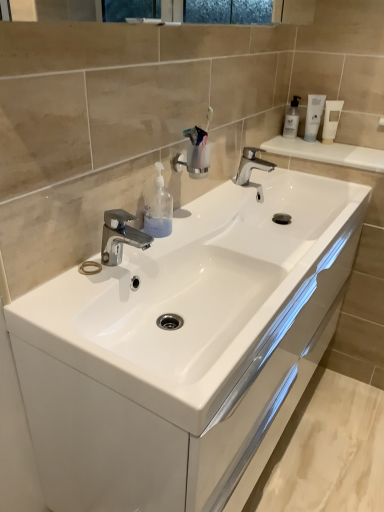
Question: Can you confirm if chrome metallic faucet at upper center, acting as the 2th tap starting from the front, is positioned to the left of white glossy tube at upper right, the first mouthwash from the right?

Choices:
 (A) yes
 (B) no

Answer: (A)

Question: Is chrome metallic faucet at upper center, marked as the 2th tap in a bottom-to-top arrangement, positioned far away from white glossy tube at upper right, which ranks as the 3th mouthwash in left-to-right order?

Choices:
 (A) yes
 (B) no

Answer: (B)

Question: Is chrome metallic faucet at upper center, acting as the 2th tap starting from the front, facing away from white glossy tube at upper right, which ranks as the 3th mouthwash in left-to-right order?

Choices:
 (A) yes
 (B) no

Answer: (B)

Question: Would you say chrome metallic faucet at upper center, placed as the first tap when sorted from back to front, contains white glossy tube at upper right, the first mouthwash from the right?

Choices:
 (A) no
 (B) yes

Answer: (A)

Question: From a real-world perspective, is chrome metallic faucet at upper center, placed as the first tap when sorted from back to front, on white glossy tube at upper right, the first mouthwash from the right?

Choices:
 (A) yes
 (B) no

Answer: (B)

Question: Considering the relative positions of chrome metallic faucet at upper center, acting as the 2th tap starting from the front, and white glossy tube at upper right, which ranks as the 3th mouthwash in left-to-right order, in the image provided, is chrome metallic faucet at upper center, acting as the 2th tap starting from the front, behind white glossy tube at upper right, which ranks as the 3th mouthwash in left-to-right order,?

Choices:
 (A) yes
 (B) no

Answer: (B)

Question: Is transparent plastic mouthwash at upper right, which ranks as the 1th mouthwash in left-to-right order, bigger than transparent plastic soap dispenser at center?

Choices:
 (A) no
 (B) yes

Answer: (A)

Question: Is transparent plastic mouthwash at upper right, which ranks as the 1th mouthwash in left-to-right order, closer to camera compared to transparent plastic soap dispenser at center?

Choices:
 (A) no
 (B) yes

Answer: (A)

Question: Does transparent plastic mouthwash at upper right, which appears as the 3th mouthwash when viewed from the right, appear on the right side of transparent plastic soap dispenser at center?

Choices:
 (A) no
 (B) yes

Answer: (B)

Question: Is transparent plastic soap dispenser at center inside transparent plastic mouthwash at upper right, which appears as the 3th mouthwash when viewed from the right?

Choices:
 (A) yes
 (B) no

Answer: (B)

Question: Can you confirm if transparent plastic mouthwash at upper right, which appears as the 3th mouthwash when viewed from the right, is taller than transparent plastic soap dispenser at center?

Choices:
 (A) yes
 (B) no

Answer: (B)

Question: From the image's perspective, is transparent plastic mouthwash at upper right, which ranks as the 1th mouthwash in left-to-right order, over transparent plastic soap dispenser at center?

Choices:
 (A) no
 (B) yes

Answer: (B)

Question: Considering the relative sizes of white glossy tube at upper right, the first mouthwash from the right, and transparent plastic soap dispenser at center in the image provided, is white glossy tube at upper right, the first mouthwash from the right, taller than transparent plastic soap dispenser at center?

Choices:
 (A) yes
 (B) no

Answer: (B)